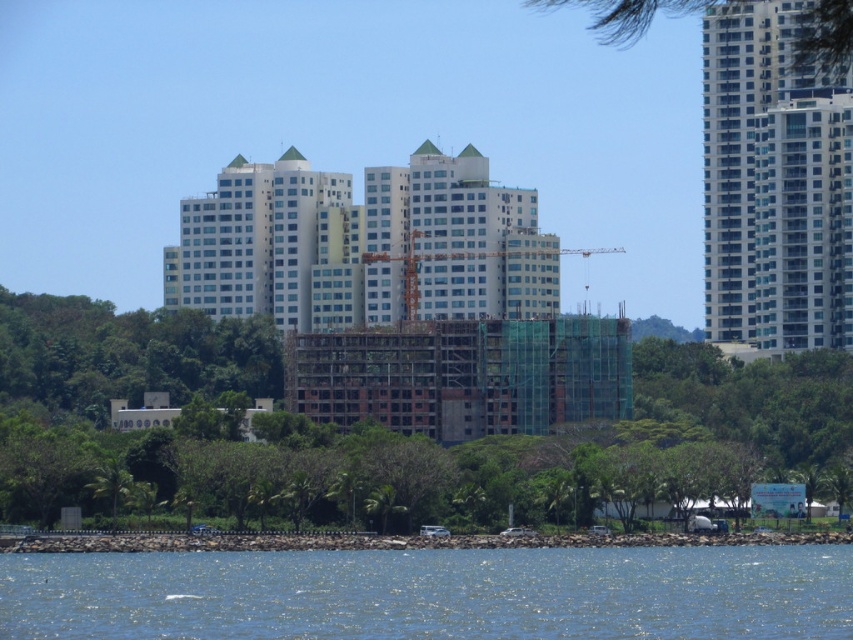
You are standing at the point marked as point (433, 593) in the image. What is the closest object to you in the scene?

The closest object to you at point (433, 593) is the blue liquid water at lower center, as it is located exactly at that coordinate.

You are a bird flying over the coastal urban landscape. You want to land on the tallest object between the green leafy tree at center and the blue liquid water at lower center. Which one should you choose?

The green leafy tree at center is much taller than the blue liquid water at lower center, so you should land on the green leafy tree at center.

You are a drone operator tasked with capturing aerial footage of the glassy concrete skyscraper at upper right. Your drone has a maximum operational range of 600 meters. Based on the scene, can your drone safely reach the skyscraper without exceeding its range?

The distance between the glassy concrete skyscraper at upper right and the camera is 658.94 meters. Since the drone can only operate up to 600 meters, it cannot safely reach the skyscraper without exceeding its range.